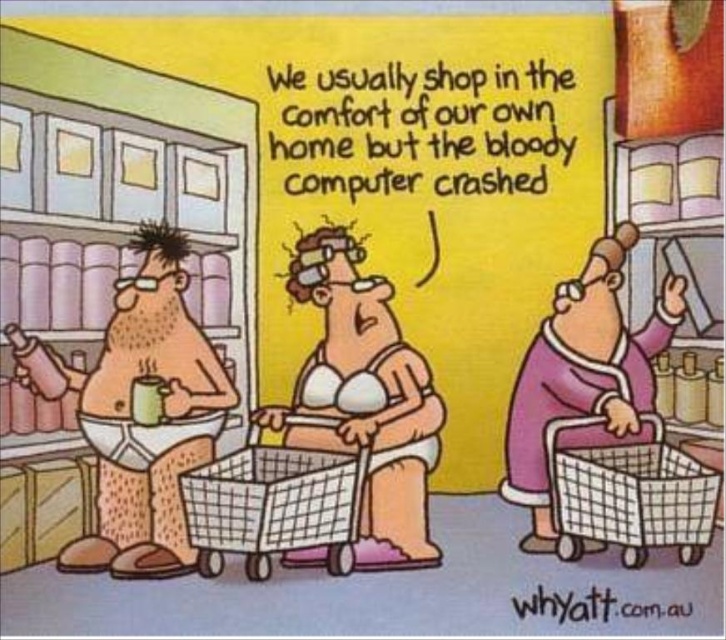
The image size is (726, 640). What do you see at coordinates (139, 412) in the screenshot?
I see `brown paper bag at left` at bounding box center [139, 412].

Between brown paper bag at left and plastic mesh shopping cart at lower right, which one appears on the left side from the viewer's perspective?

brown paper bag at left is more to the left.

Where is `brown paper bag at left`? The image size is (726, 640). brown paper bag at left is located at coordinates (139, 412).

The image size is (726, 640). What do you see at coordinates (274, 506) in the screenshot?
I see `white mesh shopping cart at center` at bounding box center [274, 506].

Is point (258, 552) closer to camera compared to point (629, 522)?

No, it is not.

At what (x,y) coordinates should I click in order to perform the action: click on white mesh shopping cart at center. Please return your answer as a coordinate pair (x, y). The width and height of the screenshot is (726, 640). Looking at the image, I should click on (274, 506).

Is point (150, 232) less distant than point (293, 499)?

No, it is not.

At what (x,y) coordinates should I click in order to perform the action: click on brown paper bag at left. Please return your answer as a coordinate pair (x, y). Image resolution: width=726 pixels, height=640 pixels. Looking at the image, I should click on (139, 412).